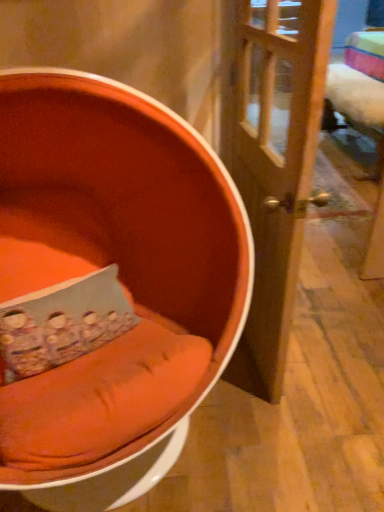
Identify the location of vacant area located to the right-hand side of wooden door at center. (333, 336).